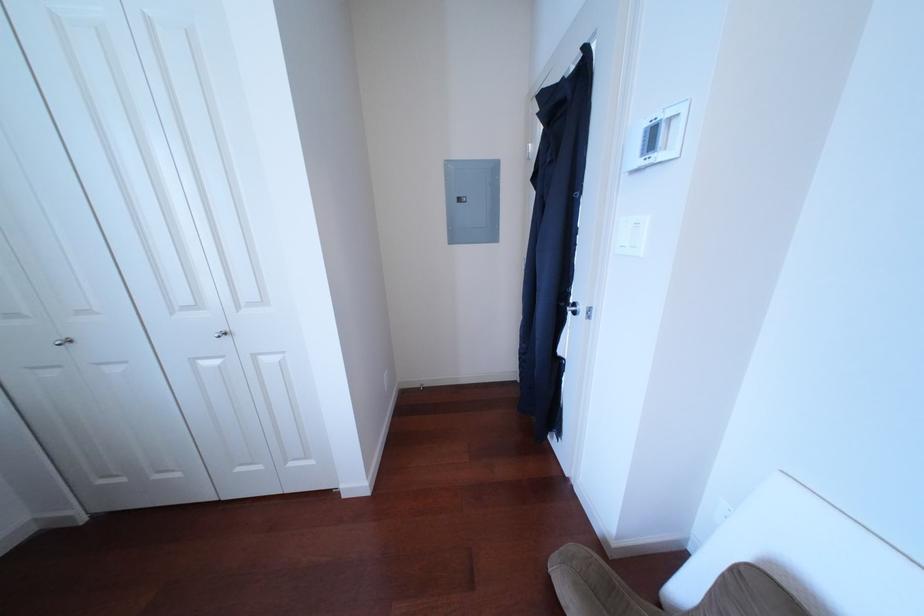
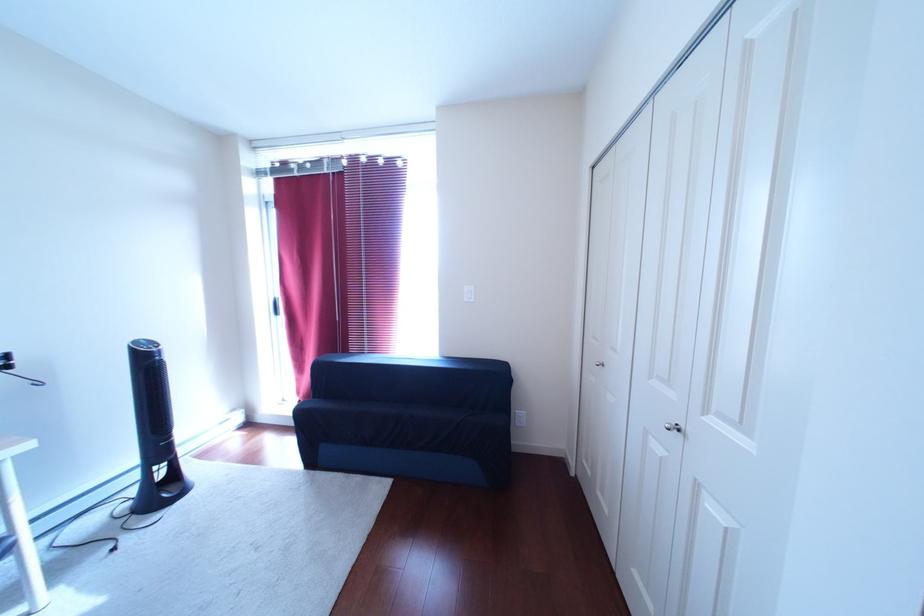
Question: The camera is either moving clockwise (left) or counter-clockwise (right) around the object. The first image is from the beginning of the video and the second image is from the end. Is the camera moving left or right when shooting the video?

Choices:
 (A) Left
 (B) Right

Answer: (B)